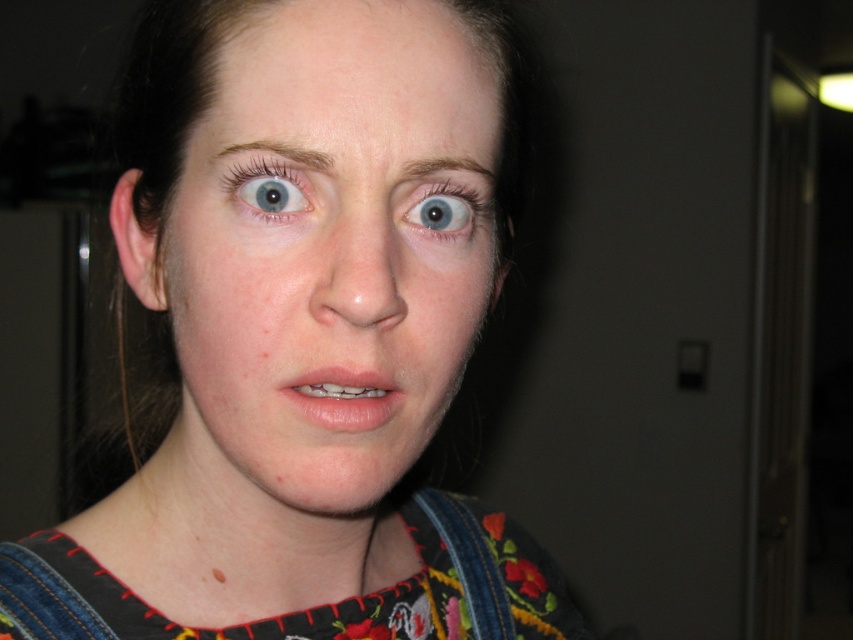
Which is behind, point (486, 268) or point (418, 212)?

Positioned behind is point (486, 268).

The width and height of the screenshot is (853, 640). Describe the element at coordinates (325, 257) in the screenshot. I see `smooth skin face at center` at that location.

Find the location of `smooth skin face at center`. smooth skin face at center is located at coordinates (325, 257).

Who is positioned more to the left, smooth skin face at center or dark brown eyebrow at upper center?

Positioned to the left is smooth skin face at center.

Is smooth skin face at center to the right of dark brown eyebrow at upper center from the viewer's perspective?

No, smooth skin face at center is not to the right of dark brown eyebrow at upper center.

I want to click on smooth skin face at center, so click(325, 257).

Consider the image. How distant is jeans at center from smooth skin face at center?

They are 1.76 inches apart.

Who is positioned more to the right, jeans at center or smooth skin face at center?

Positioned to the right is smooth skin face at center.

Which is in front, point (215, 449) or point (332, 44)?

Point (332, 44) is in front.

Where is `jeans at center`? This screenshot has width=853, height=640. jeans at center is located at coordinates (296, 340).